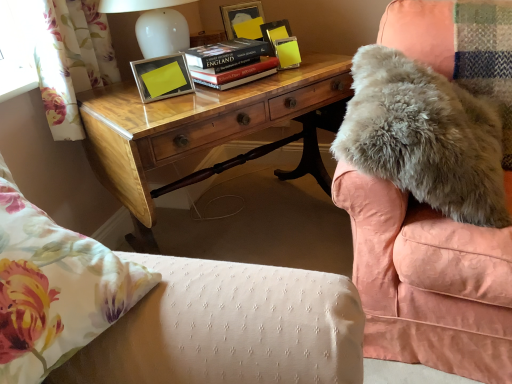
Question: Is hardcover book at center touching floral fabric pillow at lower left?

Choices:
 (A) yes
 (B) no

Answer: (B)

Question: From a real-world perspective, is hardcover book at center beneath floral fabric pillow at lower left?

Choices:
 (A) no
 (B) yes

Answer: (B)

Question: Can you confirm if hardcover book at center is wider than floral fabric pillow at lower left?

Choices:
 (A) no
 (B) yes

Answer: (A)

Question: Are hardcover book at center and floral fabric pillow at lower left far apart?

Choices:
 (A) yes
 (B) no

Answer: (B)

Question: Is hardcover book at center further to camera compared to floral fabric pillow at lower left?

Choices:
 (A) yes
 (B) no

Answer: (A)

Question: In terms of height, does wooden desk at center look taller or shorter compared to floral fabric pillow at lower left?

Choices:
 (A) short
 (B) tall

Answer: (B)

Question: In the image, is wooden desk at center on the left side or the right side of floral fabric pillow at lower left?

Choices:
 (A) left
 (B) right

Answer: (B)

Question: Is wooden desk at center bigger or smaller than floral fabric pillow at lower left?

Choices:
 (A) small
 (B) big

Answer: (B)

Question: Is wooden desk at center situated inside floral fabric pillow at lower left or outside?

Choices:
 (A) outside
 (B) inside

Answer: (A)

Question: Looking at their shapes, would you say floral fabric curtain at left is wider or thinner than metallic yellow picture frame at upper center?

Choices:
 (A) thin
 (B) wide

Answer: (B)

Question: From the image's perspective, relative to metallic yellow picture frame at upper center, is floral fabric curtain at left above or below?

Choices:
 (A) below
 (B) above

Answer: (B)

Question: Is floral fabric curtain at left inside or outside of metallic yellow picture frame at upper center?

Choices:
 (A) outside
 (B) inside

Answer: (A)

Question: In terms of height, does floral fabric curtain at left look taller or shorter compared to metallic yellow picture frame at upper center?

Choices:
 (A) tall
 (B) short

Answer: (A)

Question: From the image's perspective, relative to floral fabric curtain at left, is hardcover book at center above or below?

Choices:
 (A) below
 (B) above

Answer: (A)

Question: Is hardcover book at center taller or shorter than floral fabric curtain at left?

Choices:
 (A) short
 (B) tall

Answer: (A)